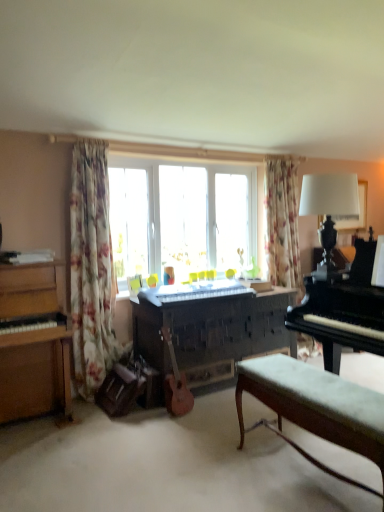
At what (x,y) coordinates should I click in order to perform the action: click on vacant region to the left of velvet green bench at lower right. Please return your answer as a coordinate pair (x, y). The height and width of the screenshot is (512, 384). Looking at the image, I should click on tap(205, 474).